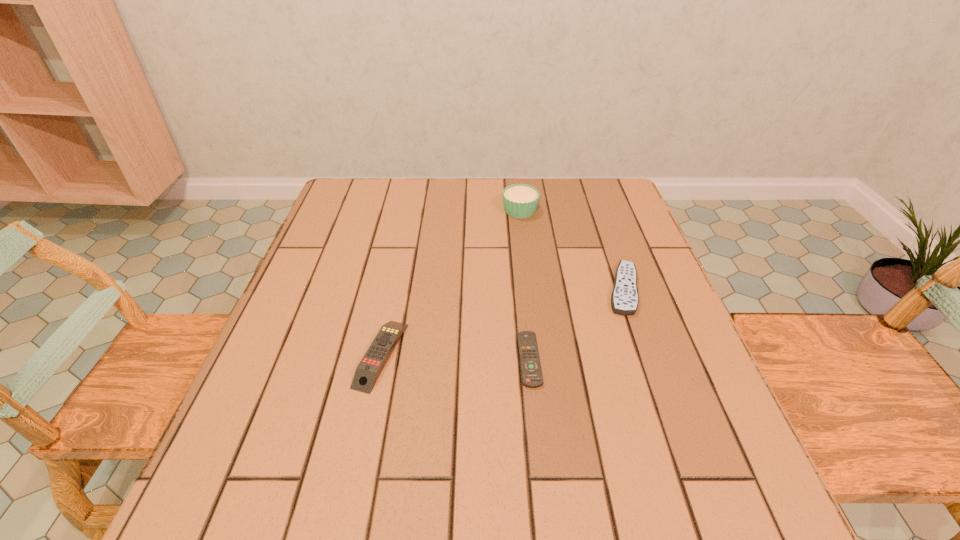
Locate an element on the screen. The height and width of the screenshot is (540, 960). the tallest object is located at coordinates (520, 201).

At what (x,y) coordinates should I click in order to perform the action: click on cupcake. Please return your answer as a coordinate pair (x, y). The width and height of the screenshot is (960, 540). Looking at the image, I should click on (520, 201).

Find the location of a particular element. Image resolution: width=960 pixels, height=540 pixels. the leftmost object is located at coordinates (367, 371).

Locate an element on the screen. the rightmost remote control is located at coordinates (624, 299).

Find the location of a particular element. the second shortest object is located at coordinates (624, 299).

I want to click on the second remote control from left to right, so click(x=531, y=371).

Where is `the shortest object`? The image size is (960, 540). the shortest object is located at coordinates (531, 371).

I want to click on vacant space located on the left of the cupcake, so click(x=398, y=210).

Locate an element on the screen. vacant space located 0.130m on the left of the leftmost remote control is located at coordinates (292, 355).

You are a GUI agent. You are given a task and a screenshot of the screen. Output one action in this format:
    pyautogui.click(x=<x>, y=<y>)
    Task: Click on the free location located on the back of the farthest remote control
    
    Given the screenshot: What is the action you would take?
    pyautogui.click(x=608, y=245)